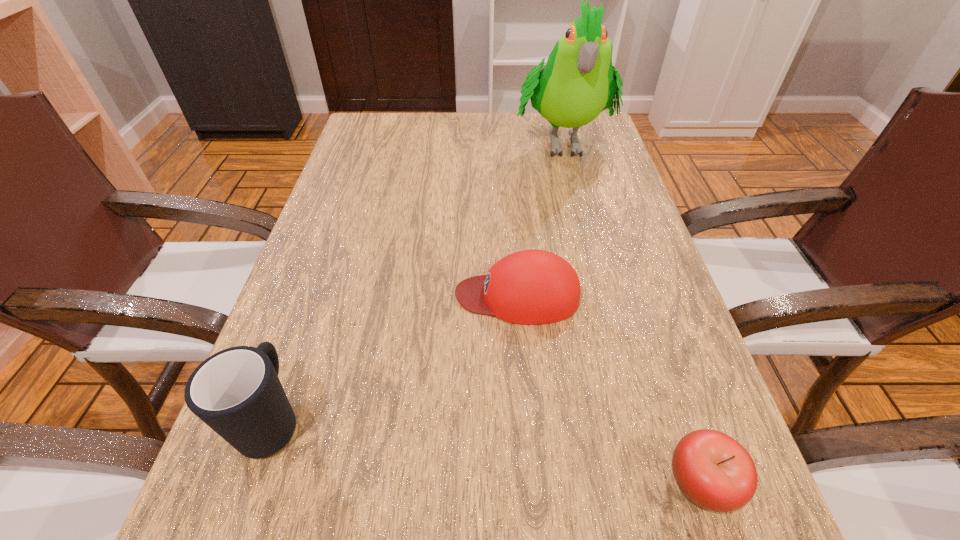
At what (x,y) coordinates should I click in order to perform the action: click on parakeet. Please return your answer as a coordinate pair (x, y). This screenshot has height=540, width=960. Looking at the image, I should click on (578, 82).

I want to click on the tallest object, so [578, 82].

The width and height of the screenshot is (960, 540). I want to click on mug, so click(x=236, y=392).

What are the coordinates of `the leftmost object` in the screenshot? It's located at (236, 392).

Where is `baseball cap`? baseball cap is located at coordinates (530, 287).

Identify the location of apple. (715, 472).

Find the location of a particular element. vacant region located on the beak of the tallest object is located at coordinates (575, 196).

The image size is (960, 540). I want to click on vacant area situated 0.330m on the side of the leftmost object with the handle, so click(x=334, y=242).

You are a GUI agent. You are given a task and a screenshot of the screen. Output one action in this format:
    pyautogui.click(x=<x>, y=<y>)
    Task: Click on the vacant area located 0.350m on the side of the leftmost object with the handle
    This screenshot has height=540, width=960.
    Given the screenshot: What is the action you would take?
    pyautogui.click(x=336, y=235)

At what (x,y) coordinates should I click in order to perform the action: click on vacant space situated 0.150m on the side of the leftmost object with the handle. Please return your answer as a coordinate pair (x, y). The image size is (960, 540). Looking at the image, I should click on (312, 305).